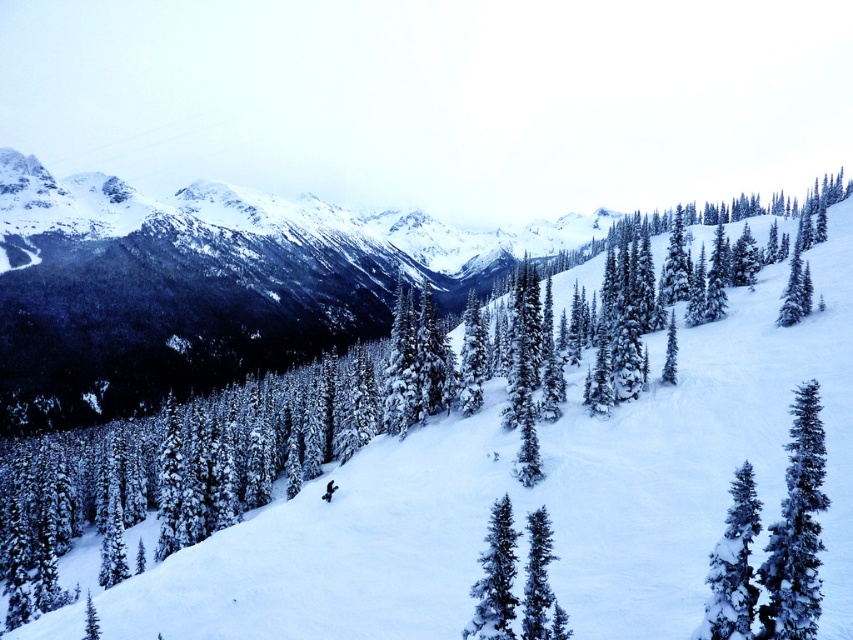
Question: Which object appears closest to the camera in this image?

Choices:
 (A) snow-covered evergreen at center-right
 (B) snow-covered evergreen at lower right
 (C) black matte snowboarder at center

Answer: (B)

Question: Is snow-covered evergreen at center-right closer to camera compared to snow-covered pine tree at center?

Choices:
 (A) yes
 (B) no

Answer: (A)

Question: Which object is the farthest from the green matte tree at center?

Choices:
 (A) snow-covered evergreen at center-right
 (B) snow-covered evergreen at lower right
 (C) black matte snowboarder at center

Answer: (C)

Question: Does snow-covered evergreen at center-right have a larger size compared to snow-covered pine tree at center?

Choices:
 (A) no
 (B) yes

Answer: (B)

Question: Which point is farther from the camera taking this photo?

Choices:
 (A) (543, 611)
 (B) (508, 540)
 (C) (437, 497)

Answer: (C)

Question: From the image, what is the correct spatial relationship of snow-covered evergreen at center-right in relation to green matte tree at center?

Choices:
 (A) below
 (B) above

Answer: (B)